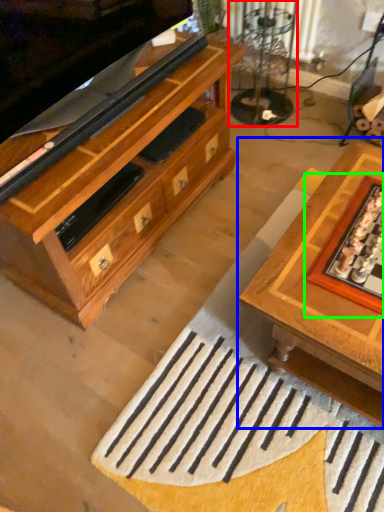
Question: Which object is the closest to the glass table (highlighted by a red box)? Choose among these: table (highlighted by a blue box) or board game (highlighted by a green box).

Choices:
 (A) table
 (B) board game

Answer: (A)